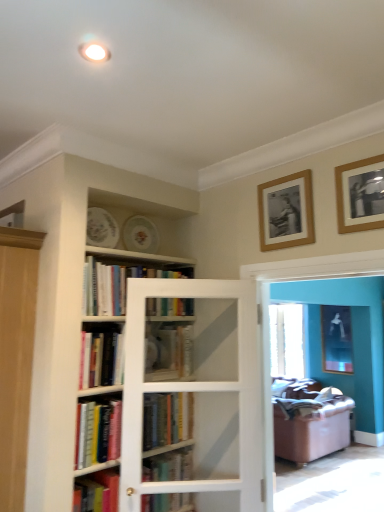
Where is `free space above matte glass screen door at center, marked as the second screen door in a left-to-right arrangement (from a real-world perspective)`? The image size is (384, 512). free space above matte glass screen door at center, marked as the second screen door in a left-to-right arrangement (from a real-world perspective) is located at coordinates (307, 256).